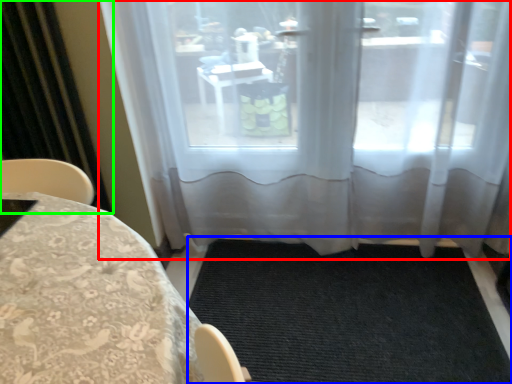
Question: Estimate the real-world distances between objects in this image. Which object is farther from window (highlighted by a red box), doormat (highlighted by a blue box) or curtain (highlighted by a green box)?

Choices:
 (A) doormat
 (B) curtain

Answer: (B)